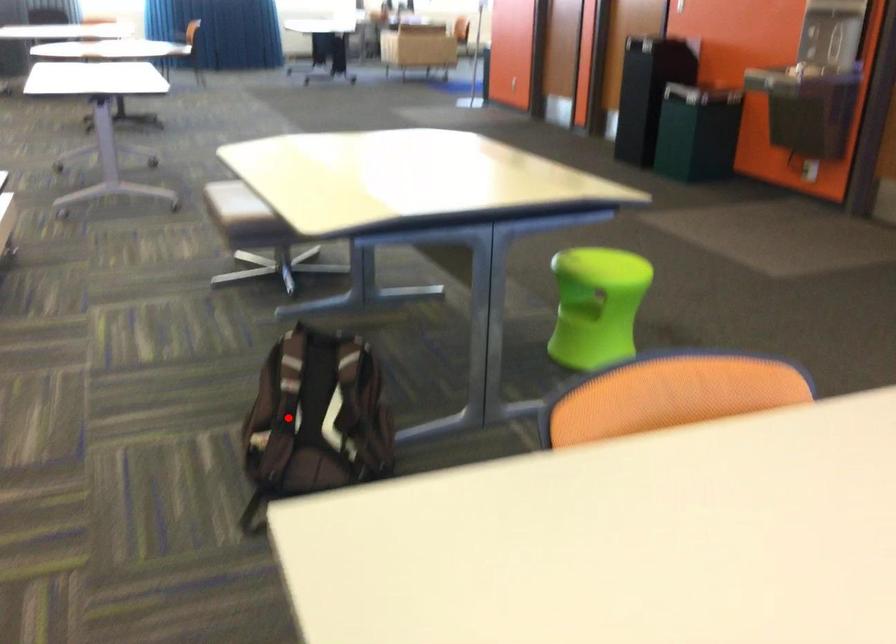
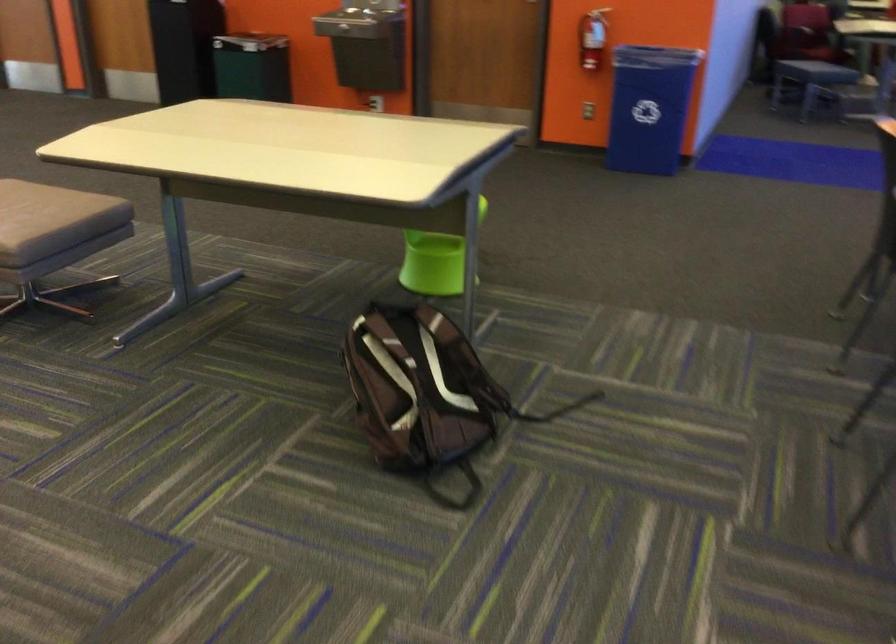
Find the pixel in the second image that matches the highlighted location in the first image.

(419, 392)